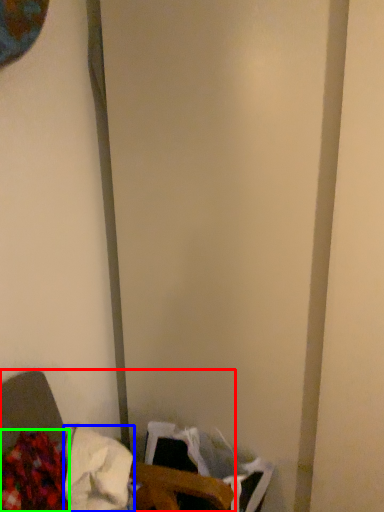
Question: Estimate the real-world distances between objects in this image. Which object is closer to furniture (highlighted by a red box), waste (highlighted by a blue box) or waste (highlighted by a green box)?

Choices:
 (A) waste
 (B) waste

Answer: (A)